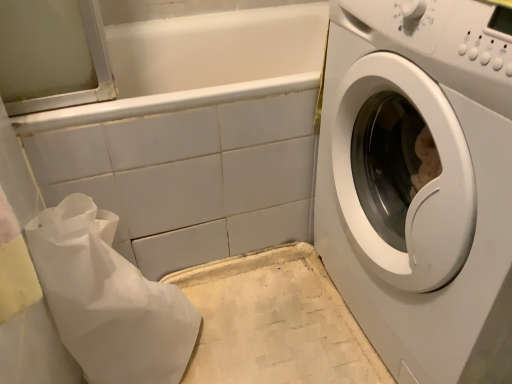
Image resolution: width=512 pixels, height=384 pixels. What do you see at coordinates (421, 183) in the screenshot?
I see `white glossy washing machine at right` at bounding box center [421, 183].

Find the location of `white paper bag at lower left`. white paper bag at lower left is located at coordinates (108, 299).

Is white glossy washing machine at right surrounded by white paper bag at lower left?

No, white glossy washing machine at right is not inside white paper bag at lower left.

Does white paper bag at lower left turn towards white glossy washing machine at right?

Yes, white paper bag at lower left is turned towards white glossy washing machine at right.

In the image, there is a white glossy washing machine at right. Where is `material below it (from a real-world perspective)`? Image resolution: width=512 pixels, height=384 pixels. material below it (from a real-world perspective) is located at coordinates (108, 299).

From a real-world perspective, is white paper bag at lower left beneath white glossy washing machine at right?

Yes.

Based on their positions, is white glossy bathtub at upper center located to the left or right of white paper bag at lower left?

white glossy bathtub at upper center is to the right of white paper bag at lower left.

Which object is wider, white glossy bathtub at upper center or white paper bag at lower left?

white glossy bathtub at upper center is wider.

This screenshot has width=512, height=384. I want to click on material in front of the white glossy bathtub at upper center, so click(108, 299).

Are white glossy bathtub at upper center and white paper bag at lower left located far from each other?

No, white glossy bathtub at upper center is not far away from white paper bag at lower left.

Considering the sizes of white textured mat at lower center and white glossy bathtub at upper center in the image, is white textured mat at lower center taller or shorter than white glossy bathtub at upper center?

white textured mat at lower center is shorter than white glossy bathtub at upper center.

In the image, is white textured mat at lower center positioned in front of or behind white glossy bathtub at upper center?

Clearly, white textured mat at lower center is behind white glossy bathtub at upper center.

This screenshot has height=384, width=512. What are the coordinates of `counter top that appears behind the white glossy bathtub at upper center` in the screenshot? It's located at (274, 322).

Is white textured mat at lower center at the left side of white glossy bathtub at upper center?

In fact, white textured mat at lower center is to the right of white glossy bathtub at upper center.

Locate an element on the screen. This screenshot has height=384, width=512. material that is in front of the white glossy bathtub at upper center is located at coordinates (108, 299).

Choose the correct answer: Is white paper bag at lower left inside white glossy bathtub at upper center or outside it?

white paper bag at lower left is located beyond the bounds of white glossy bathtub at upper center.

In the scene shown: Does white paper bag at lower left touch white glossy bathtub at upper center?

white paper bag at lower left and white glossy bathtub at upper center are not in contact.

Is white paper bag at lower left to the left of white glossy bathtub at upper center from the viewer's perspective?

Indeed, white paper bag at lower left is positioned on the left side of white glossy bathtub at upper center.

Looking at the image, does white glossy washing machine at right seem bigger or smaller compared to white textured mat at lower center?

Clearly, white glossy washing machine at right is larger in size than white textured mat at lower center.

Is white glossy washing machine at right completely or partially outside of white textured mat at lower center?

Indeed, white glossy washing machine at right is completely outside white textured mat at lower center.

From the image's perspective, is white glossy washing machine at right above or below white textured mat at lower center?

white glossy washing machine at right is situated higher than white textured mat at lower center in the image.

Considering the relative sizes of white glossy washing machine at right and white textured mat at lower center in the image provided, is white glossy washing machine at right wider than white textured mat at lower center?

No, white glossy washing machine at right is not wider than white textured mat at lower center.

Is white glossy bathtub at upper center completely or partially inside white glossy washing machine at right?

Definitely not — white glossy bathtub at upper center is not inside white glossy washing machine at right.

Which of these two, white glossy washing machine at right or white glossy bathtub at upper center, is bigger?

white glossy bathtub at upper center is bigger.

Can you tell me how much white glossy washing machine at right and white glossy bathtub at upper center differ in facing direction?

The angle between the facing direction of white glossy washing machine at right and the facing direction of white glossy bathtub at upper center is 90.6 degrees.

In terms of width, does white glossy washing machine at right look wider or thinner when compared to white glossy bathtub at upper center?

In the image, white glossy washing machine at right appears to be more narrow than white glossy bathtub at upper center.

Is white paper bag at lower left situated inside white textured mat at lower center or outside?

white paper bag at lower left lies outside white textured mat at lower center.

Which point is more forward, (144, 328) or (312, 249)?

Positioned in front is point (144, 328).

Could you tell me if white paper bag at lower left is turned towards white textured mat at lower center?

Yes, white paper bag at lower left faces towards white textured mat at lower center.

What's the angular difference between white paper bag at lower left and white textured mat at lower center's facing directions?

white paper bag at lower left and white textured mat at lower center are facing 90.6 degrees away from each other.

Locate an element on the screen. This screenshot has height=384, width=512. washing machine on the right of the white paper bag at lower left is located at coordinates (421, 183).

This screenshot has width=512, height=384. In order to click on material in front of the white glossy bathtub at upper center in this screenshot , I will do `click(108, 299)`.

Which object lies nearer to the anchor point white glossy bathtub at upper center, white paper bag at lower left or white textured mat at lower center?

Among the two, white paper bag at lower left is located nearer to white glossy bathtub at upper center.

From the image, which object appears to be nearer to white textured mat at lower center, white paper bag at lower left or white glossy washing machine at right?

white paper bag at lower left is closer to white textured mat at lower center.

Looking at the image, which one is located further to white textured mat at lower center, white glossy washing machine at right or white glossy bathtub at upper center?

white glossy washing machine at right is further to white textured mat at lower center.

From the image, which object appears to be farther from white textured mat at lower center, white glossy bathtub at upper center or white paper bag at lower left?

white paper bag at lower left lies further to white textured mat at lower center than the other object.

Based on their spatial positions, is white glossy bathtub at upper center or white glossy washing machine at right closer to white paper bag at lower left?

white glossy bathtub at upper center lies closer to white paper bag at lower left than the other object.

Looking at the image, which one is located closer to white textured mat at lower center, white paper bag at lower left or white glossy bathtub at upper center?

white glossy bathtub at upper center is closer to white textured mat at lower center.

Based on their spatial positions, is white glossy washing machine at right or white glossy bathtub at upper center further from white paper bag at lower left?

The object further to white paper bag at lower left is white glossy washing machine at right.

Considering their positions, is white textured mat at lower center positioned closer to white glossy washing machine at right than white glossy bathtub at upper center?

Based on the image, white textured mat at lower center appears to be nearer to white glossy washing machine at right.

Identify the location of material between white glossy bathtub at upper center and white textured mat at lower center in the vertical direction. The width and height of the screenshot is (512, 384). (108, 299).

The height and width of the screenshot is (384, 512). What are the coordinates of `counter top located between white glossy bathtub at upper center and white glossy washing machine at right in the left-right direction` in the screenshot? It's located at (274, 322).

Where is `counter top situated between white paper bag at lower left and white glossy washing machine at right from left to right`? counter top situated between white paper bag at lower left and white glossy washing machine at right from left to right is located at coordinates (274, 322).

Locate an element on the screen. This screenshot has height=384, width=512. bath situated between white paper bag at lower left and white glossy washing machine at right from left to right is located at coordinates (195, 135).